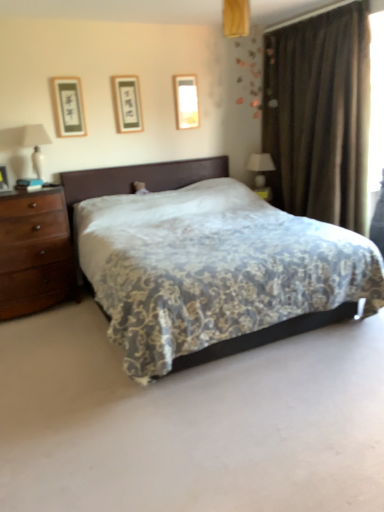
The height and width of the screenshot is (512, 384). Identify the location of vacant space in front of floral-patterned fabric bed at center. (204, 425).